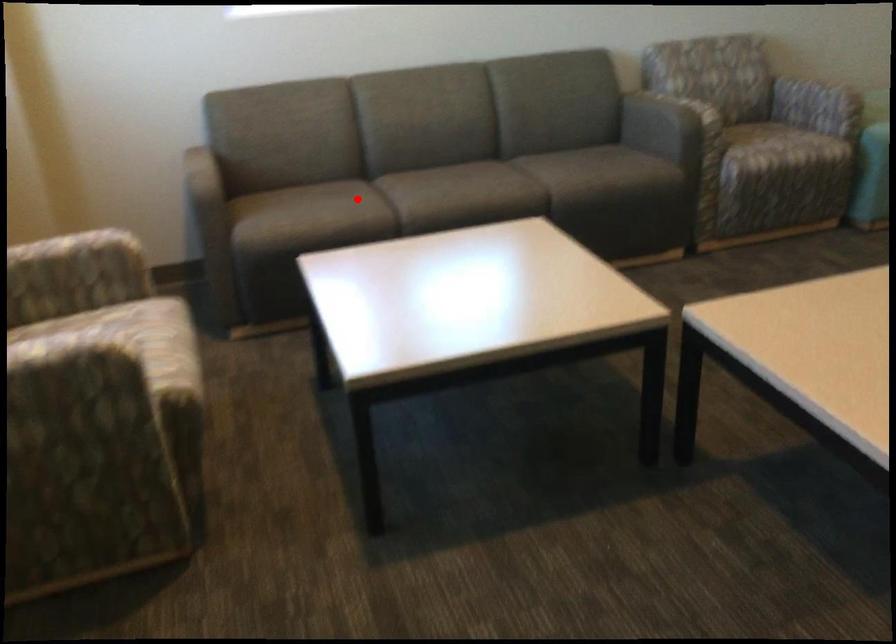
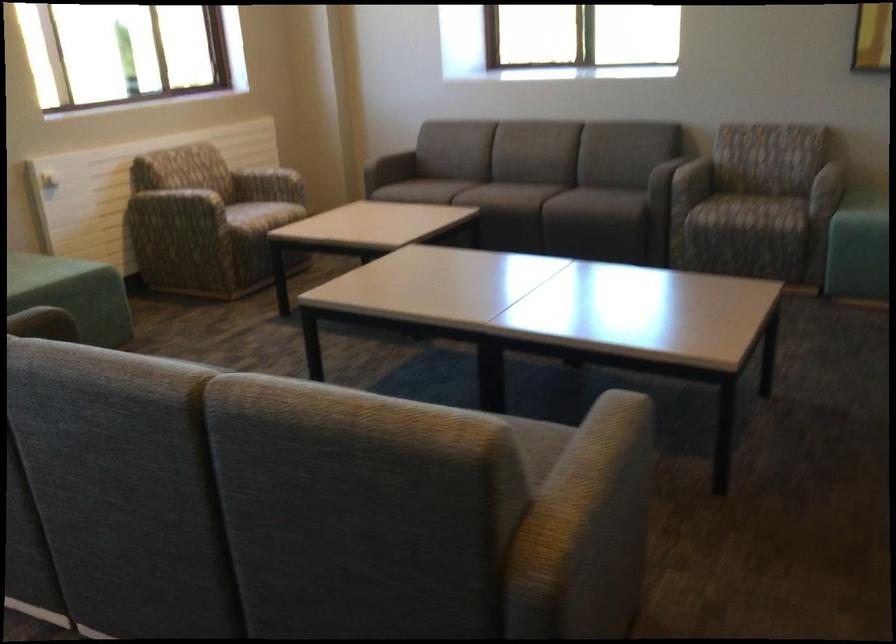
Find the pixel in the second image that matches the highlighted location in the first image.

(455, 187)